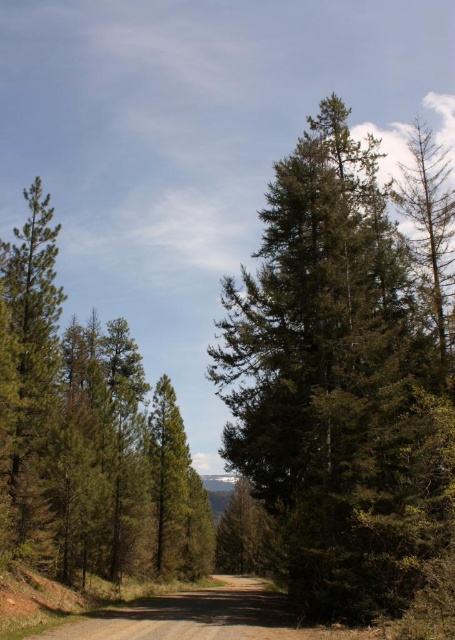
Question: Which point is closer to the camera taking this photo?

Choices:
 (A) (127, 516)
 (B) (425, 401)
 (C) (151, 637)

Answer: (C)

Question: Can you confirm if green textured pine tree at left is positioned below brown gravel road at center?

Choices:
 (A) no
 (B) yes

Answer: (A)

Question: Among these points, which one is farthest from the camera?

Choices:
 (A) (119, 348)
 (B) (181, 592)
 (C) (269, 356)

Answer: (B)

Question: Which point appears farthest from the camera in this image?

Choices:
 (A) (124, 378)
 (B) (141, 605)
 (C) (414, 428)

Answer: (A)

Question: Is green textured tree at center to the right of brown gravel road at center from the viewer's perspective?

Choices:
 (A) no
 (B) yes

Answer: (B)

Question: Does green textured tree at center have a greater width compared to green textured pine tree at left?

Choices:
 (A) yes
 (B) no

Answer: (A)